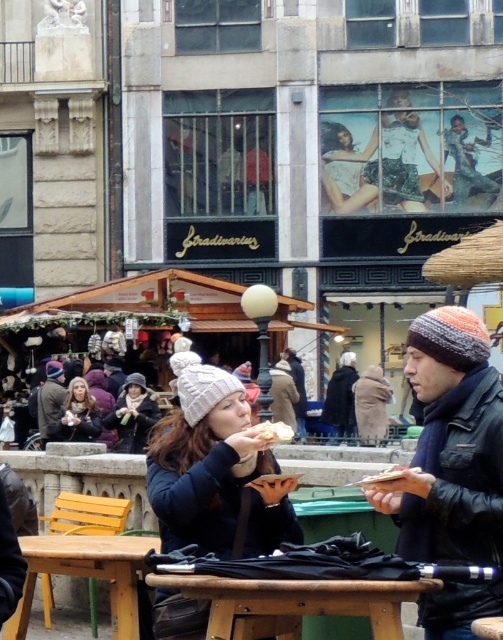
Question: Is white knit hat at center to the left of light brown hair at lower left from the viewer's perspective?

Choices:
 (A) yes
 (B) no

Answer: (B)

Question: Which object appears closest to the camera in this image?

Choices:
 (A) wooden table at center
 (B) golden crumbly bread at center
 (C) matte gray knit hat at center

Answer: (A)

Question: Which point appears farthest from the camera in this image?

Choices:
 (A) (139, 385)
 (B) (245, 531)

Answer: (A)

Question: Does matte gray knit hat at center appear on the right side of golden crumbly bread at center?

Choices:
 (A) no
 (B) yes

Answer: (A)

Question: Which of the following is the closest to the observer?

Choices:
 (A) (34, 588)
 (B) (258, 436)
 (C) (135, 428)
 (D) (58, 371)

Answer: (B)

Question: Is wooden table at lower center thinner than golden crumbly bread at center?

Choices:
 (A) yes
 (B) no

Answer: (B)